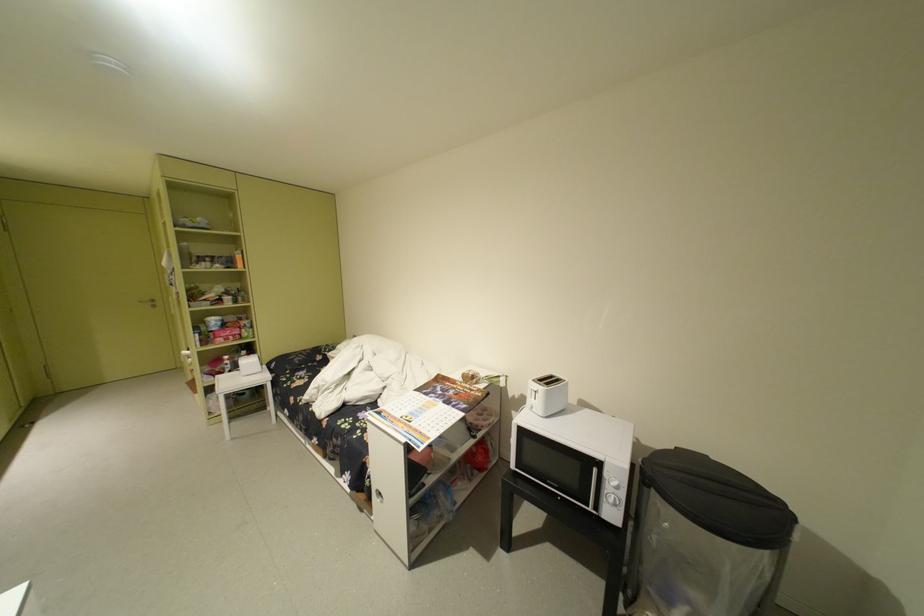
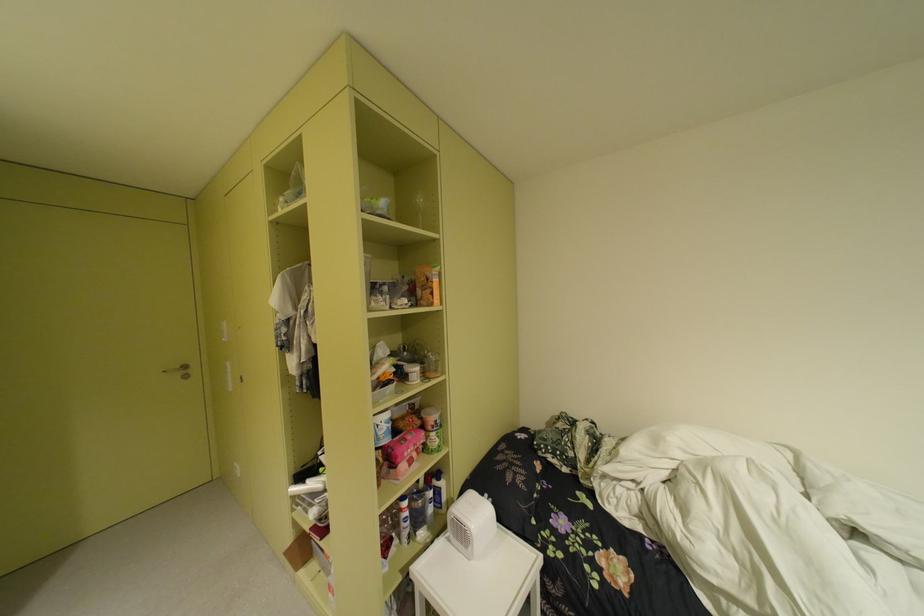
The point at (228,265) is marked in the first image. Where is the corresponding point in the second image?

(417, 301)